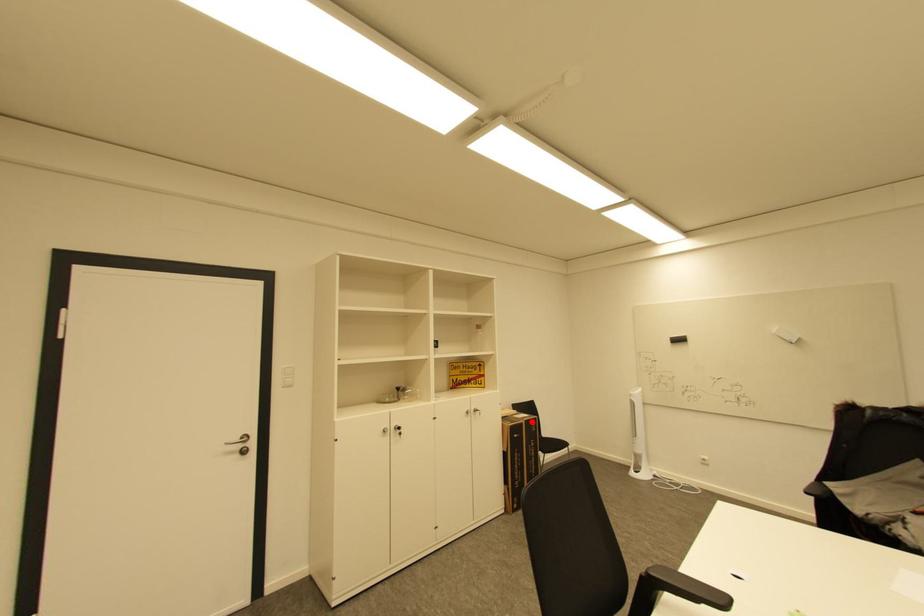
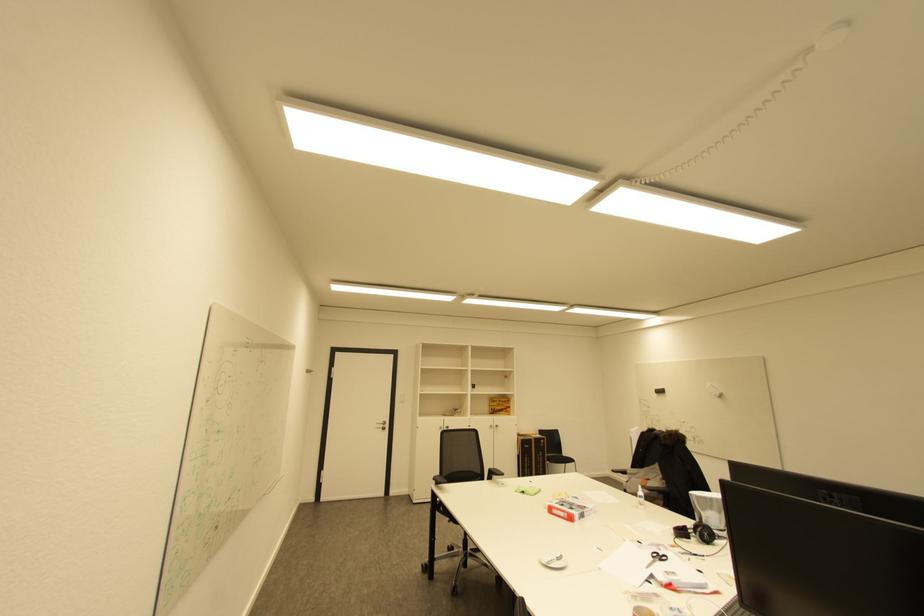
Where in the second image is the point corresponding to the highlighted location from the first image?

(541, 439)